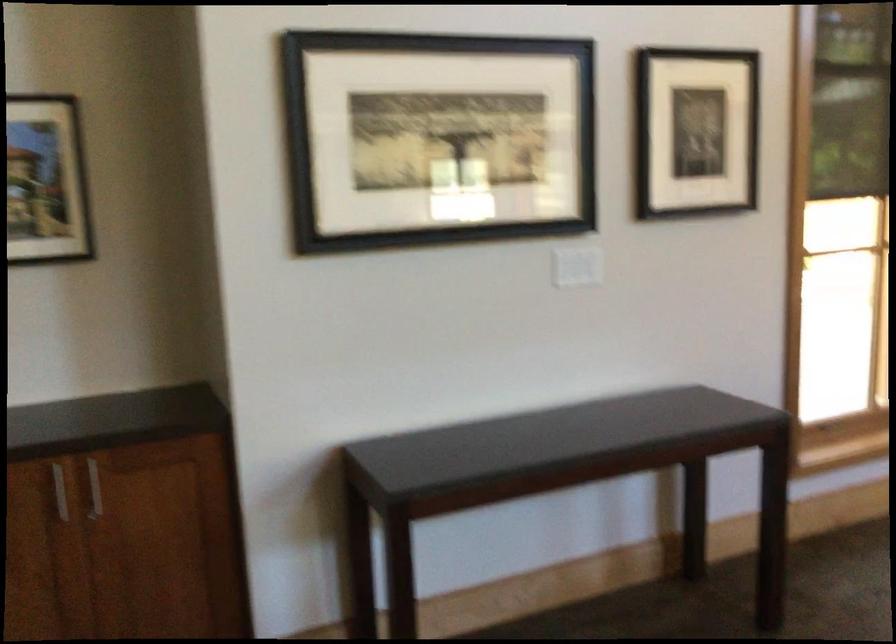
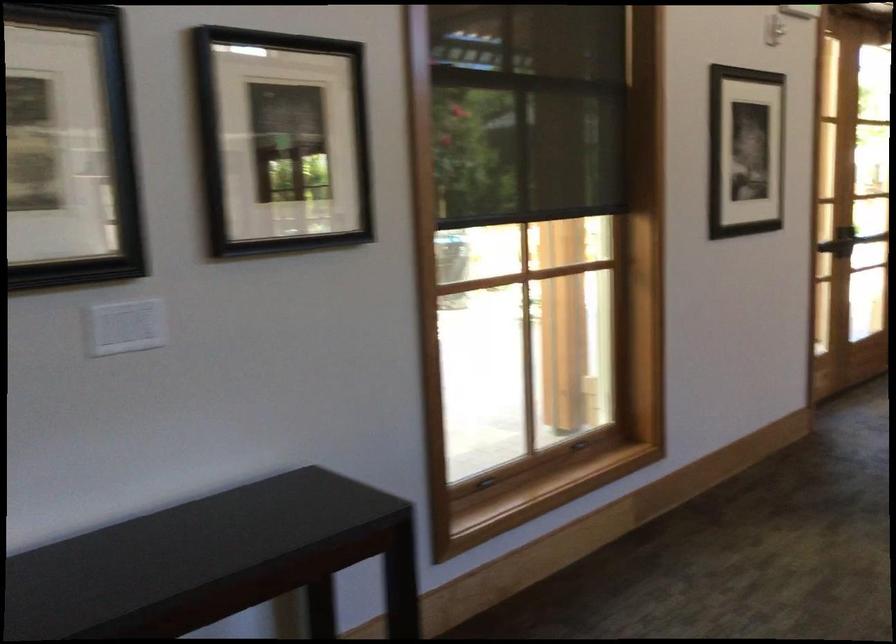
The images are taken continuously from a first-person perspective. In which direction are you moving?

The cameraman moved toward right, forward.